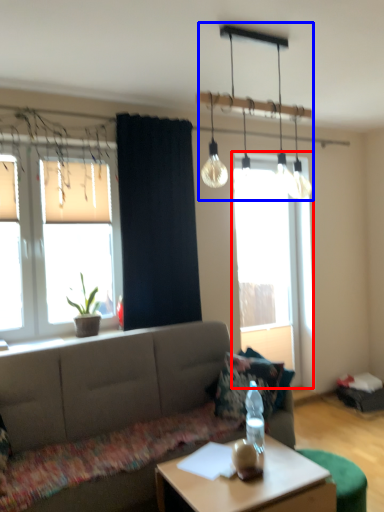
Question: Among these objects, which one is farthest to the camera, window (highlighted by a red box) or chandelier (highlighted by a blue box)?

Choices:
 (A) window
 (B) chandelier

Answer: (A)